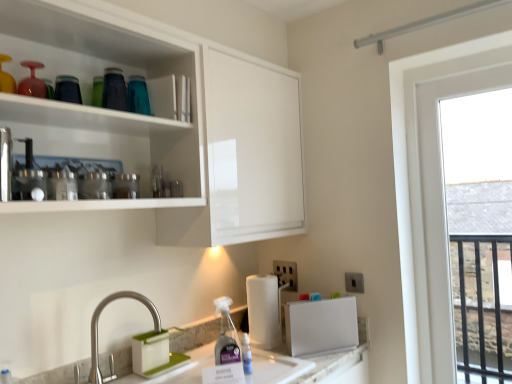
Question: From the image's perspective, is transparent glass window at right over white plastic electric outlet at lower center, marked as the first electric outlet in a left-to-right arrangement?

Choices:
 (A) no
 (B) yes

Answer: (B)

Question: Considering the relative sizes of transparent glass window at right and white plastic electric outlet at lower center, which is the second electric outlet in right-to-left order, in the image provided, is transparent glass window at right thinner than white plastic electric outlet at lower center, which is the second electric outlet in right-to-left order,?

Choices:
 (A) no
 (B) yes

Answer: (A)

Question: Is transparent glass window at right at the left side of white plastic electric outlet at lower center, which is the second electric outlet in right-to-left order?

Choices:
 (A) no
 (B) yes

Answer: (A)

Question: Is transparent glass window at right wider than white plastic electric outlet at lower center, placed as the second electric outlet when sorted from front to back?

Choices:
 (A) no
 (B) yes

Answer: (B)

Question: From a real-world perspective, does transparent glass window at right stand above white plastic electric outlet at lower center, marked as the first electric outlet in a left-to-right arrangement?

Choices:
 (A) yes
 (B) no

Answer: (A)

Question: Considering the relative sizes of transparent glass window at right and white plastic electric outlet at lower center, which ranks as the 1th electric outlet in back-to-front order, in the image provided, is transparent glass window at right shorter than white plastic electric outlet at lower center, which ranks as the 1th electric outlet in back-to-front order,?

Choices:
 (A) no
 (B) yes

Answer: (A)

Question: Can you confirm if white plastic electric outlet at lower center, which ranks as the 1th electric outlet in back-to-front order, is shorter than polished stainless steel faucet at lower left?

Choices:
 (A) no
 (B) yes

Answer: (B)

Question: From a real-world perspective, does white plastic electric outlet at lower center, which is the second electric outlet in right-to-left order, sit lower than polished stainless steel faucet at lower left?

Choices:
 (A) no
 (B) yes

Answer: (A)

Question: Does white plastic electric outlet at lower center, placed as the second electric outlet when sorted from front to back, have a larger size compared to polished stainless steel faucet at lower left?

Choices:
 (A) no
 (B) yes

Answer: (A)

Question: Is white plastic electric outlet at lower center, marked as the first electric outlet in a left-to-right arrangement, to the left of polished stainless steel faucet at lower left from the viewer's perspective?

Choices:
 (A) yes
 (B) no

Answer: (B)

Question: Could you tell me if white plastic electric outlet at lower center, which ranks as the 1th electric outlet in back-to-front order, is turned towards polished stainless steel faucet at lower left?

Choices:
 (A) no
 (B) yes

Answer: (B)

Question: Does white plastic electric outlet at lower center, which ranks as the 1th electric outlet in back-to-front order, have a greater height compared to polished stainless steel faucet at lower left?

Choices:
 (A) yes
 (B) no

Answer: (B)

Question: Considering the relative sizes of metallic silver blender at upper left, which is counted as the second appliance, starting from the back, and white plastic electric outlet at lower center, which is the second electric outlet in right-to-left order, in the image provided, is metallic silver blender at upper left, which is counted as the second appliance, starting from the back, thinner than white plastic electric outlet at lower center, which is the second electric outlet in right-to-left order,?

Choices:
 (A) no
 (B) yes

Answer: (A)